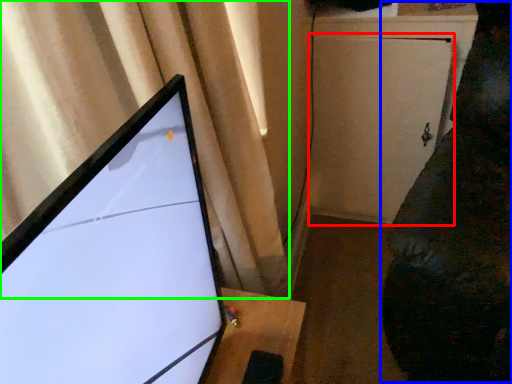
Question: Which object is the farthest from screen door (highlighted by a red box)? Choose among these: couch (highlighted by a blue box) or curtain (highlighted by a green box).

Choices:
 (A) couch
 (B) curtain

Answer: (B)